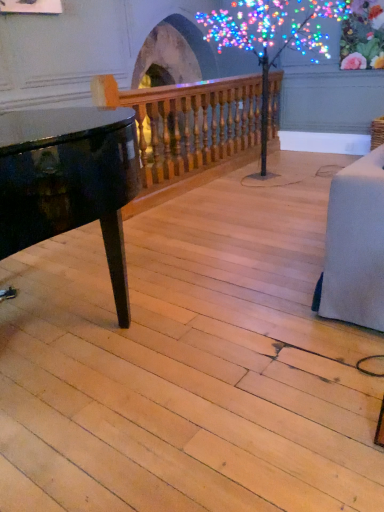
Where is `vacant region in front of illuminated plastic tree at center`? vacant region in front of illuminated plastic tree at center is located at coordinates (243, 222).